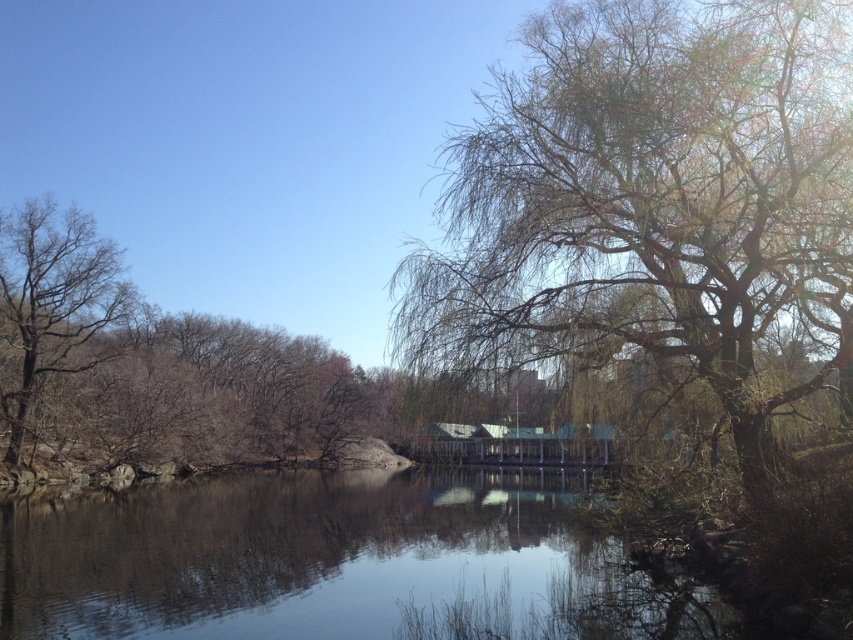
Between bare branches at right and bare wood tree at left, which one appears on the left side from the viewer's perspective?

Positioned to the left is bare wood tree at left.

Does bare branches at right come in front of bare wood tree at left?

Yes, bare branches at right is closer to the viewer.

Who is more forward, (457, 314) or (25, 426)?

Point (457, 314) is more forward.

At what (x,y) coordinates should I click in order to perform the action: click on bare branches at right. Please return your answer as a coordinate pair (x, y). Looking at the image, I should click on (653, 202).

Between point (190, 566) and point (33, 198), which one is positioned in front?

Point (190, 566)

Between smooth reflective water at center and bare wood tree at left, which one appears on the right side from the viewer's perspective?

smooth reflective water at center

Does point (28, 560) lie in front of point (73, 284)?

Yes, point (28, 560) is in front of point (73, 284).

Image resolution: width=853 pixels, height=640 pixels. In order to click on smooth reflective water at center in this screenshot , I will do `click(334, 563)`.

From the picture: Which of these two, bare branches at right or smooth reflective water at center, stands taller?

With more height is bare branches at right.

Does bare branches at right appear over smooth reflective water at center?

Correct, bare branches at right is located above smooth reflective water at center.

Image resolution: width=853 pixels, height=640 pixels. Describe the element at coordinates (653, 202) in the screenshot. I see `bare branches at right` at that location.

At what (x,y) coordinates should I click in order to perform the action: click on bare branches at right. Please return your answer as a coordinate pair (x, y). The width and height of the screenshot is (853, 640). Looking at the image, I should click on (653, 202).